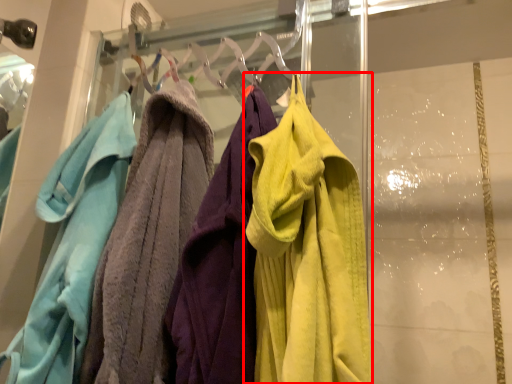
Question: From the image's perspective, what is the correct spatial positioning of towel (annotated by the red box) in reference to towel?

Choices:
 (A) below
 (B) above

Answer: (B)